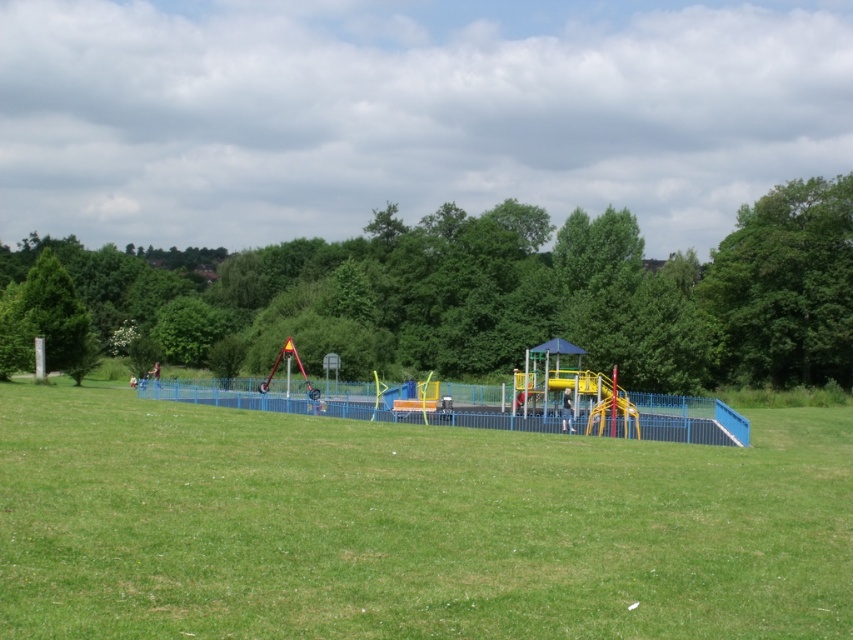
You are a parent trying to decide where to place a picnic blanket in the playground. You want to ensure it is under the shade of the green leafy tree at center but also close to the metallic blue playground at center. Based on their widths, can you determine if the tree provides enough coverage for the blanket to be both shaded and near the playground?

The green leafy tree at center might be wider than metallic blue playground at center, so there is a possibility that the tree could provide sufficient shade coverage for the picnic blanket to be placed both under its shade and near the playground.

You are a parent trying to find shade for your child at the playground. You see the green leafy tree at upper right and the metallic blue playground at center. Which object would provide more shade for your child?

The green leafy tree at upper right is located above the metallic blue playground at center, so it would provide more shade for your child.

You are a parent trying to decide where to place a new picnic blanket in the park. You want to ensure it is under the shade of the green leafy tree at center but also close to the metallic blue playground at center for your kids to play. Based on the scene, can you determine the direction you should place the blanket relative to the playground?

The green leafy tree at center is positioned on the left side of metallic blue playground at center, so placing the picnic blanket to the left of the metallic blue playground at center would place it under the tree while keeping it near the playground.